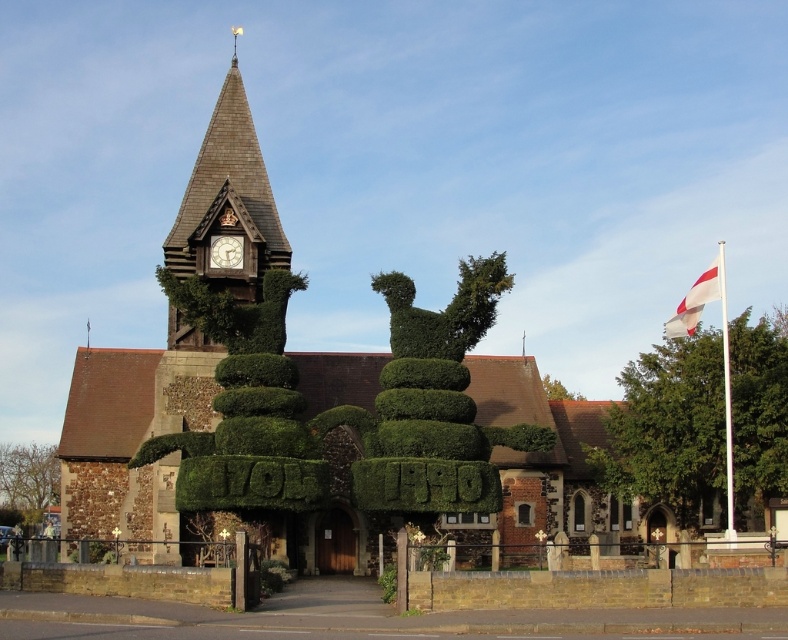
In the scene shown: Who is more distant from viewer, (51, 500) or (688, 324)?

The point (51, 500) is behind.

Who is more forward, (9, 497) or (720, 266)?

Point (9, 497) is in front.

Does point (0, 467) come farther from viewer compared to point (704, 292)?

Yes, it is.

Where is `green leafy bush at lower left`? The width and height of the screenshot is (788, 640). green leafy bush at lower left is located at coordinates (28, 481).

The image size is (788, 640). Find the location of `white fabric flag at right`. white fabric flag at right is located at coordinates (697, 300).

Who is more distant from viewer, (664, 330) or (218, 268)?

Point (664, 330)

In order to click on white fabric flag at right in this screenshot , I will do `click(697, 300)`.

I want to click on white fabric flag at right, so click(697, 300).

Which is behind, point (678, 305) or point (558, 384)?

The point (678, 305) is more distant.

Is white fabric flag at right above green leafy tree at center?

Indeed, white fabric flag at right is positioned over green leafy tree at center.

This screenshot has height=640, width=788. I want to click on white fabric flag at right, so click(697, 300).